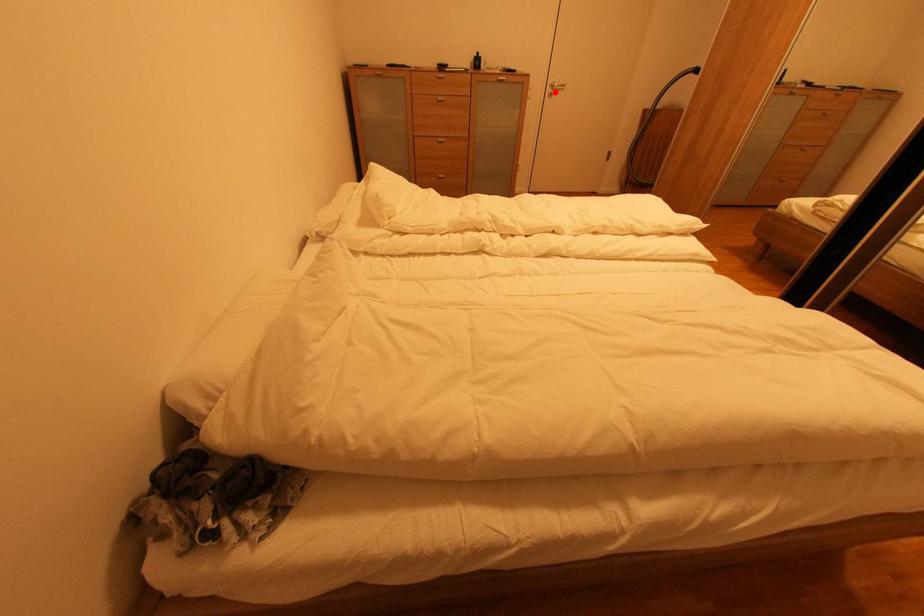
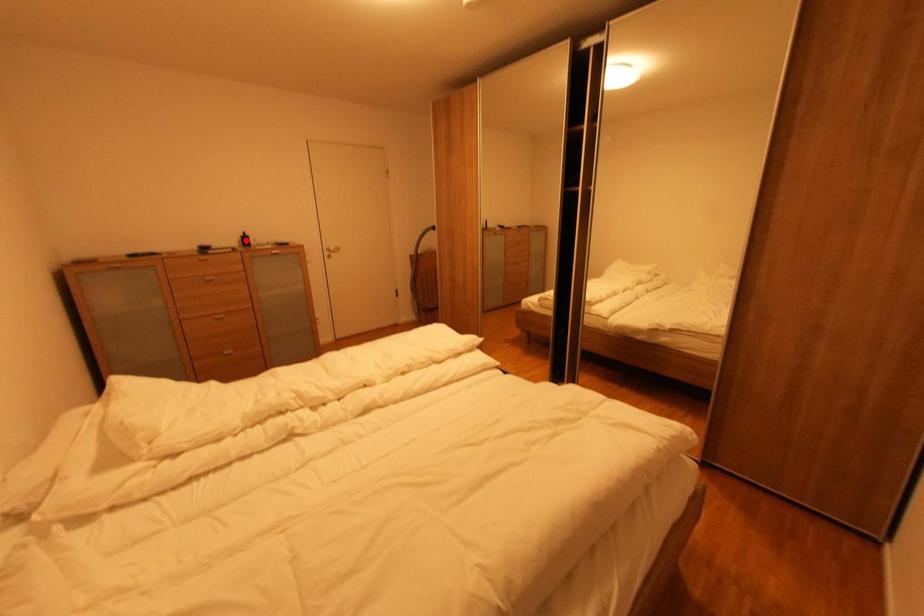
I am providing you with two images of the same scene from different viewpoints. A red point is marked on the first image and another point is marked on the second image. Does the point marked in image1 correspond to the same location as the one in image2?

No